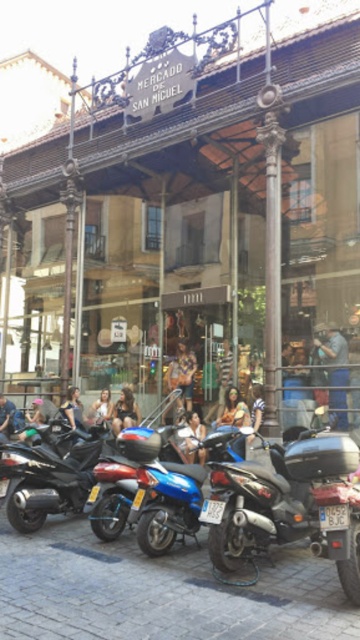
Question: Observing the image, what is the correct spatial positioning of shiny black motorcycle at center in reference to striped fabric shirt at center?

Choices:
 (A) above
 (B) below

Answer: (B)

Question: Which object appears closest to the camera in this image?

Choices:
 (A) striped fabric shirt at center
 (B) dark blue jeans at center
 (C) gray cobblestone pavement at lower center
 (D) shiny black motorcycle at center

Answer: (C)

Question: Does denim jacket at center lie behind matte brown leather jacket at center?

Choices:
 (A) no
 (B) yes

Answer: (B)

Question: Which object is closer to the camera taking this photo?

Choices:
 (A) yellow fabric shorts at center
 (B) light brown leather jacket at center

Answer: (A)

Question: Estimate the real-world distances between objects in this image. Which object is farther from the gray cobblestone pavement at lower center?

Choices:
 (A) yellow fabric shorts at center
 (B) striped fabric shirt at center
 (C) leather jacket at center

Answer: (C)

Question: Is the position of light brown leather jacket at center less distant than that of blue leather jacket at lower left?

Choices:
 (A) yes
 (B) no

Answer: (A)